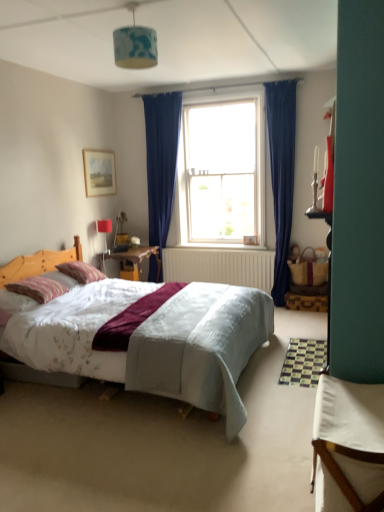
Question: Does wooden picture frame at upper left turn towards blue fabric lampshade at upper center?

Choices:
 (A) no
 (B) yes

Answer: (A)

Question: Is wooden picture frame at upper left turned away from blue fabric lampshade at upper center?

Choices:
 (A) yes
 (B) no

Answer: (B)

Question: From a real-world perspective, does wooden picture frame at upper left sit lower than blue fabric lampshade at upper center?

Choices:
 (A) no
 (B) yes

Answer: (B)

Question: Considering the relative sizes of wooden picture frame at upper left and blue fabric lampshade at upper center in the image provided, is wooden picture frame at upper left taller than blue fabric lampshade at upper center?

Choices:
 (A) yes
 (B) no

Answer: (A)

Question: Would you say blue fabric lampshade at upper center is part of wooden picture frame at upper left's contents?

Choices:
 (A) yes
 (B) no

Answer: (B)

Question: Is wooden picture frame at upper left to the left or to the right of blue fabric lampshade at upper center in the image?

Choices:
 (A) right
 (B) left

Answer: (B)

Question: Considering the positions of wooden picture frame at upper left and blue fabric lampshade at upper center in the image, is wooden picture frame at upper left bigger or smaller than blue fabric lampshade at upper center?

Choices:
 (A) small
 (B) big

Answer: (A)

Question: Does point (107, 188) appear closer or farther from the camera than point (145, 30)?

Choices:
 (A) closer
 (B) farther

Answer: (B)

Question: From the image's perspective, is wooden picture frame at upper left positioned above or below blue fabric lampshade at upper center?

Choices:
 (A) below
 (B) above

Answer: (A)

Question: Is point (129, 27) positioned closer to the camera than point (91, 181)?

Choices:
 (A) farther
 (B) closer

Answer: (B)

Question: From the image's perspective, relative to wooden picture frame at upper left, is blue fabric lampshade at upper center above or below?

Choices:
 (A) below
 (B) above

Answer: (B)

Question: Looking at their shapes, would you say blue fabric lampshade at upper center is wider or thinner than wooden picture frame at upper left?

Choices:
 (A) thin
 (B) wide

Answer: (B)

Question: From a real-world perspective, is blue fabric lampshade at upper center positioned above or below wooden picture frame at upper left?

Choices:
 (A) below
 (B) above

Answer: (B)

Question: Considering the positions of white glass window at center and striped cotton pillow at left, marked as the second pillow in a back-to-front arrangement, in the image, is white glass window at center taller or shorter than striped cotton pillow at left, marked as the second pillow in a back-to-front arrangement,?

Choices:
 (A) tall
 (B) short

Answer: (A)

Question: Is white glass window at center situated inside striped cotton pillow at left, the first pillow when ordered from front to back, or outside?

Choices:
 (A) inside
 (B) outside

Answer: (B)